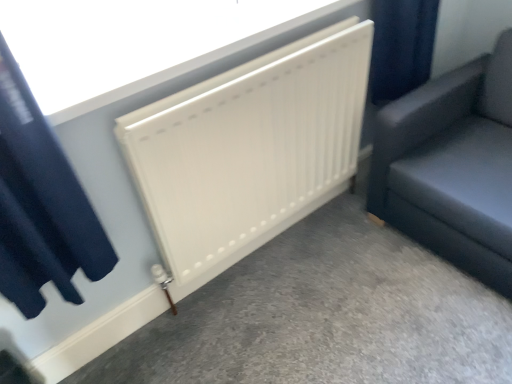
Question: Can you confirm if matte black sofa at right is taller than white matte radiator at center?

Choices:
 (A) yes
 (B) no

Answer: (A)

Question: Could you tell me if matte black sofa at right is turned towards white matte radiator at center?

Choices:
 (A) yes
 (B) no

Answer: (B)

Question: Is the surface of matte black sofa at right in direct contact with white matte radiator at center?

Choices:
 (A) no
 (B) yes

Answer: (A)

Question: Is the position of matte black sofa at right less distant than that of white matte radiator at center?

Choices:
 (A) yes
 (B) no

Answer: (B)

Question: From a real-world perspective, is matte black sofa at right below white matte radiator at center?

Choices:
 (A) yes
 (B) no

Answer: (A)

Question: From the image's perspective, is matte black sofa at right under white matte radiator at center?

Choices:
 (A) no
 (B) yes

Answer: (B)

Question: From the image's perspective, would you say white matte radiator at center is positioned over white matte radiator at center?

Choices:
 (A) yes
 (B) no

Answer: (B)

Question: From the image's perspective, is white matte radiator at center under white matte radiator at center?

Choices:
 (A) yes
 (B) no

Answer: (A)

Question: Is white matte radiator at center bigger than white matte radiator at center?

Choices:
 (A) yes
 (B) no

Answer: (A)

Question: Is white matte radiator at center at the left side of white matte radiator at center?

Choices:
 (A) yes
 (B) no

Answer: (B)

Question: From a real-world perspective, is white matte radiator at center under white matte radiator at center?

Choices:
 (A) no
 (B) yes

Answer: (B)

Question: Is white matte radiator at center not within white matte radiator at center?

Choices:
 (A) no
 (B) yes

Answer: (B)

Question: Does white matte radiator at center lie behind dark blue velvet curtain at upper left?

Choices:
 (A) yes
 (B) no

Answer: (A)